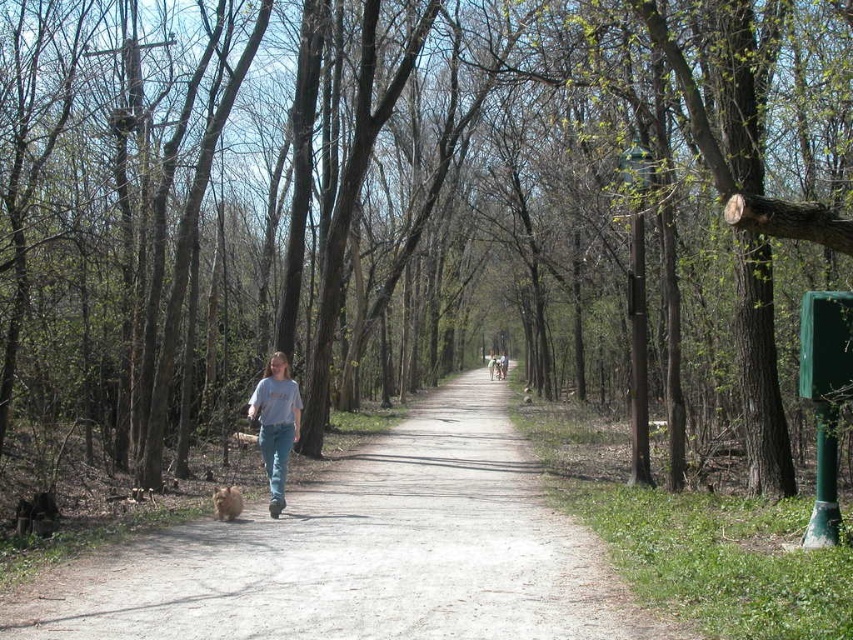
You are standing on the dirt path at center and looking down at your light blue jeans at center. Which object is lower in height?

The dirt path at center is lower in height compared to the light blue jeans at center.

You are standing at the point marked as point (364, 554) in the image. Based on the scene description, what type of surface are you currently standing on?

The point (364, 554) is on dirt path at center, so you are standing on a dirt path.

You are standing at the starting point of the dirt path at center. If you walk straight ahead, will you eventually reach the end of the path? Please explain your reasoning based on the scene description.

The dirt path at center stretches into the distance, so walking straight ahead would eventually lead to the end of the path as it is a continuous path.